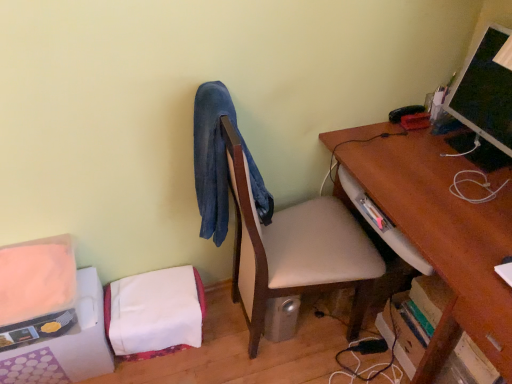
The width and height of the screenshot is (512, 384). I want to click on blank space situated above brown wood desk at right (from a real-world perspective), so click(x=451, y=185).